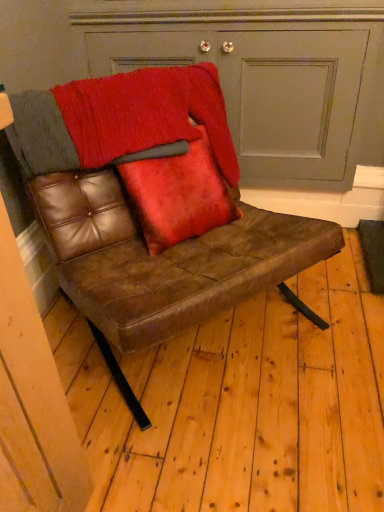
Question: Considering the relative sizes of matte gray door at upper center and textured wool blanket at upper center in the image provided, is matte gray door at upper center bigger than textured wool blanket at upper center?

Choices:
 (A) no
 (B) yes

Answer: (B)

Question: Considering the relative sizes of matte gray door at upper center and textured wool blanket at upper center in the image provided, is matte gray door at upper center thinner than textured wool blanket at upper center?

Choices:
 (A) no
 (B) yes

Answer: (A)

Question: Is matte gray door at upper center facing towards textured wool blanket at upper center?

Choices:
 (A) yes
 (B) no

Answer: (A)

Question: Is matte gray door at upper center behind textured wool blanket at upper center?

Choices:
 (A) yes
 (B) no

Answer: (A)

Question: Does matte gray door at upper center appear on the right side of textured wool blanket at upper center?

Choices:
 (A) yes
 (B) no

Answer: (A)

Question: Is matte gray door at upper center positioned before textured wool blanket at upper center?

Choices:
 (A) no
 (B) yes

Answer: (A)

Question: From a real-world perspective, is velvet red pillow at center located beneath textured wool blanket at upper center?

Choices:
 (A) yes
 (B) no

Answer: (A)

Question: Is velvet red pillow at center at the right side of textured wool blanket at upper center?

Choices:
 (A) yes
 (B) no

Answer: (A)

Question: Is velvet red pillow at center oriented towards textured wool blanket at upper center?

Choices:
 (A) no
 (B) yes

Answer: (B)

Question: Is velvet red pillow at center bigger than textured wool blanket at upper center?

Choices:
 (A) yes
 (B) no

Answer: (B)

Question: Is velvet red pillow at center taller than textured wool blanket at upper center?

Choices:
 (A) yes
 (B) no

Answer: (A)

Question: From a real-world perspective, is velvet red pillow at center positioned over textured wool blanket at upper center based on gravity?

Choices:
 (A) no
 (B) yes

Answer: (A)

Question: Is matte gray door at upper center at the back of velvet red pillow at center?

Choices:
 (A) yes
 (B) no

Answer: (A)